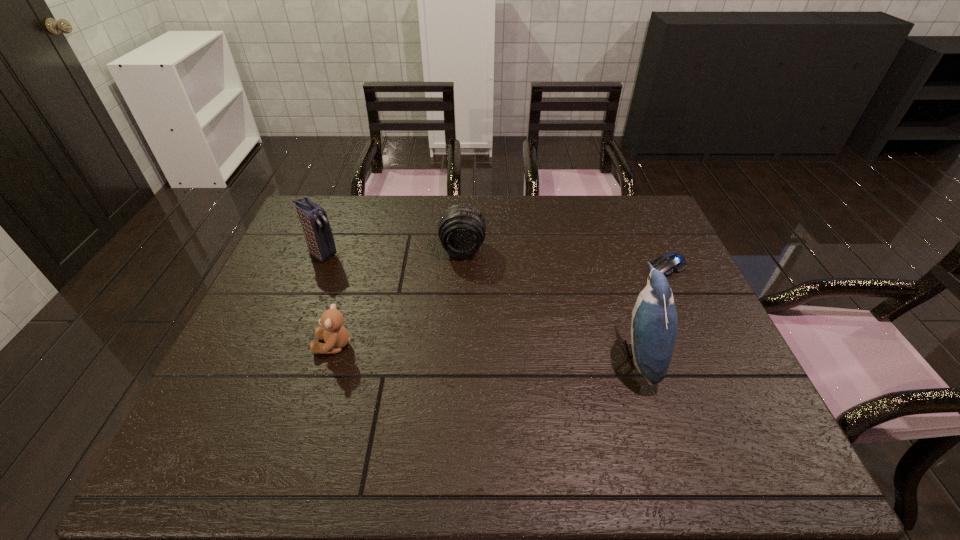
The height and width of the screenshot is (540, 960). In order to click on vacant space on the desktop that is between the teddy bear and the bird and is positioned on the button side of the shortest object in this screenshot , I will do `click(477, 350)`.

Where is `vacant space on the desktop that is between the fourth object from right to left and the second object from right to left and is positioned with the zip open on the fourth shortest object`? The height and width of the screenshot is (540, 960). vacant space on the desktop that is between the fourth object from right to left and the second object from right to left and is positioned with the zip open on the fourth shortest object is located at coordinates (466, 350).

At what (x,y) coordinates should I click in order to perform the action: click on free space on the desktop that is between the second shortest object and the tallest object and is positioned at the front element of the third shortest object. Please return your answer as a coordinate pair (x, y). The width and height of the screenshot is (960, 540). Looking at the image, I should click on click(458, 350).